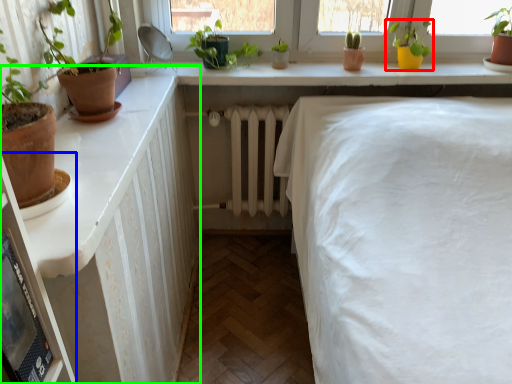
Question: Considering the real-world distances, which object is closest to houseplant (highlighted by a red box)? shelf (highlighted by a blue box) or dresser (highlighted by a green box).

Choices:
 (A) shelf
 (B) dresser

Answer: (B)